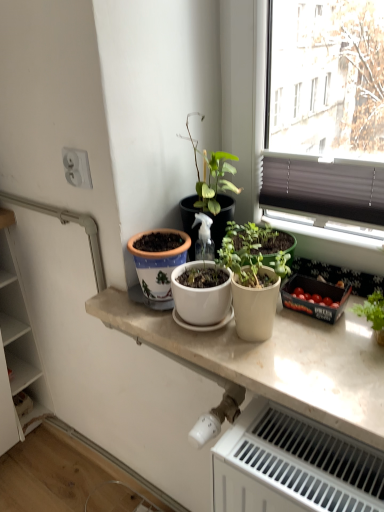
Question: Does white wood cabinet at left touch white plastic electrical outlet at upper left?

Choices:
 (A) yes
 (B) no

Answer: (B)

Question: Can you confirm if white wood cabinet at left is shorter than white plastic electrical outlet at upper left?

Choices:
 (A) yes
 (B) no

Answer: (B)

Question: From a real-world perspective, is white wood cabinet at left beneath white plastic electrical outlet at upper left?

Choices:
 (A) yes
 (B) no

Answer: (A)

Question: From the image's perspective, would you say white wood cabinet at left is shown under white plastic electrical outlet at upper left?

Choices:
 (A) yes
 (B) no

Answer: (A)

Question: Does white wood cabinet at left have a greater width compared to white plastic electrical outlet at upper left?

Choices:
 (A) no
 (B) yes

Answer: (B)

Question: Is white wood cabinet at left oriented away from white plastic electrical outlet at upper left?

Choices:
 (A) no
 (B) yes

Answer: (A)

Question: Can you confirm if white plastic electrical outlet at upper left is bigger than white wood cabinet at left?

Choices:
 (A) yes
 (B) no

Answer: (B)

Question: Are white plastic electrical outlet at upper left and white wood cabinet at left far apart?

Choices:
 (A) no
 (B) yes

Answer: (A)

Question: From the image's perspective, is white plastic electrical outlet at upper left on white wood cabinet at left?

Choices:
 (A) yes
 (B) no

Answer: (A)

Question: Could you tell me if white plastic electrical outlet at upper left is facing white wood cabinet at left?

Choices:
 (A) yes
 (B) no

Answer: (B)

Question: Is white plastic electrical outlet at upper left to the left of white wood cabinet at left from the viewer's perspective?

Choices:
 (A) no
 (B) yes

Answer: (A)

Question: Can you confirm if white plastic electrical outlet at upper left is smaller than white wood cabinet at left?

Choices:
 (A) no
 (B) yes

Answer: (B)

Question: From the image's perspective, is matte white pot at center below white plastic radiator at lower right?

Choices:
 (A) no
 (B) yes

Answer: (A)